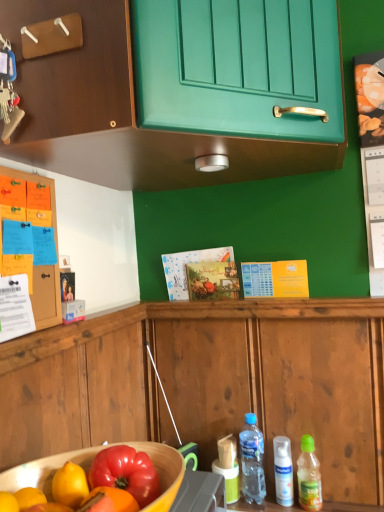
What do you see at coordinates (45, 470) in the screenshot?
I see `wooden bowl at lower left` at bounding box center [45, 470].

How much space does translucent plastic bottle at lower center, arranged as the third bottle when viewed from the right, occupy vertically?

translucent plastic bottle at lower center, arranged as the third bottle when viewed from the right, is 9.50 inches tall.

This screenshot has width=384, height=512. What are the coordinates of `wooden cabinet at left, the second cabinetry viewed from the top` in the screenshot? It's located at (46, 297).

Does wooden cabinet at left, the second cabinetry viewed from the top, touch wooden bowl at lower left?

wooden cabinet at left, the second cabinetry viewed from the top, and wooden bowl at lower left are clearly separated.

Is wooden cabinet at left, the second cabinetry viewed from the top, to the left or to the right of wooden bowl at lower left in the image?

wooden cabinet at left, the second cabinetry viewed from the top, is to the left of wooden bowl at lower left.

Looking at the image, does wooden cabinet at left, the second cabinetry viewed from the top, seem bigger or smaller compared to wooden bowl at lower left?

In the image, wooden cabinet at left, the second cabinetry viewed from the top, appears to be smaller than wooden bowl at lower left.

What's the angular difference between wooden cabinet at left, the second cabinetry viewed from the top, and wooden bowl at lower left's facing directions?

The angular difference between wooden cabinet at left, the second cabinetry viewed from the top, and wooden bowl at lower left is 0.0894 degrees.

From a real-world perspective, does white matte spray can at lower right, the 2th bottle from the left, sit lower than green matte cabinet at upper center, the 2th cabinetry when ordered from bottom to top?

Yes, from a real-world perspective, white matte spray can at lower right, the 2th bottle from the left, is beneath green matte cabinet at upper center, the 2th cabinetry when ordered from bottom to top.

Which object is further away from the camera taking this photo, white matte spray can at lower right, the 2th bottle when ordered from right to left, or green matte cabinet at upper center, the 2th cabinetry when ordered from bottom to top?

white matte spray can at lower right, the 2th bottle when ordered from right to left.

Looking at their sizes, would you say translucent plastic bottle at lower center, positioned as the first bottle in left-to-right order, is wider or thinner than wooden bowl at lower left?

Considering their sizes, translucent plastic bottle at lower center, positioned as the first bottle in left-to-right order, looks slimmer than wooden bowl at lower left.

From a real-world perspective, between translucent plastic bottle at lower center, positioned as the first bottle in left-to-right order, and wooden bowl at lower left, who is vertically lower?

translucent plastic bottle at lower center, positioned as the first bottle in left-to-right order, from a real-world perspective.

In terms of size, does translucent plastic bottle at lower center, arranged as the third bottle when viewed from the right, appear bigger or smaller than wooden bowl at lower left?

In the image, translucent plastic bottle at lower center, arranged as the third bottle when viewed from the right, appears to be smaller than wooden bowl at lower left.

Is translucent plastic bottle at lower center, arranged as the third bottle when viewed from the right, inside or outside of green plastic bottle at lower right, which is counted as the third bottle, starting from the left?

The correct answer is: outside.

Is translucent plastic bottle at lower center, arranged as the third bottle when viewed from the right, oriented towards green plastic bottle at lower right, which is counted as the third bottle, starting from the left?

No.

How different are the orientations of translucent plastic bottle at lower center, arranged as the third bottle when viewed from the right, and green plastic bottle at lower right, placed as the 1th bottle when sorted from right to left, in degrees?

The facing directions of translucent plastic bottle at lower center, arranged as the third bottle when viewed from the right, and green plastic bottle at lower right, placed as the 1th bottle when sorted from right to left, are 0.000612 degrees apart.

The height and width of the screenshot is (512, 384). In order to click on bottle lying above the green plastic bottle at lower right, placed as the 1th bottle when sorted from right to left (from the image's perspective) in this screenshot , I will do click(252, 461).

Which is correct: green plastic bottle at lower right, which is counted as the third bottle, starting from the left, is inside wooden bowl at lower left, or outside of it?

green plastic bottle at lower right, which is counted as the third bottle, starting from the left, is spatially situated outside wooden bowl at lower left.

Is green plastic bottle at lower right, placed as the 1th bottle when sorted from right to left, facing away from wooden bowl at lower left?

green plastic bottle at lower right, placed as the 1th bottle when sorted from right to left, does not have its back to wooden bowl at lower left.

Which object is wider, green plastic bottle at lower right, which is counted as the third bottle, starting from the left, or wooden bowl at lower left?

Wider between the two is wooden bowl at lower left.

Is green plastic bottle at lower right, which is counted as the third bottle, starting from the left, not close to wooden bowl at lower left?

No, green plastic bottle at lower right, which is counted as the third bottle, starting from the left, is not far from wooden bowl at lower left.

Can you tell me how much green matte cabinet at upper center, which is counted as the first cabinetry, starting from the top, and wooden bowl at lower left differ in facing direction?

The angle between the facing direction of green matte cabinet at upper center, which is counted as the first cabinetry, starting from the top, and the facing direction of wooden bowl at lower left is 90 degrees.

Where is `the 2nd cabinetry behind the wooden bowl at lower left, starting your count from the anchor`? The image size is (384, 512). the 2nd cabinetry behind the wooden bowl at lower left, starting your count from the anchor is located at coordinates (181, 91).

Relative to wooden bowl at lower left, is green matte cabinet at upper center, the 2th cabinetry when ordered from bottom to top, in front or behind?

In the image, green matte cabinet at upper center, the 2th cabinetry when ordered from bottom to top, appears behind wooden bowl at lower left.

Is point (120, 153) less distant than point (50, 464)?

No, it is not.

Is wooden bowl at lower left smaller than green plastic bottle at lower right, placed as the 1th bottle when sorted from right to left?

Incorrect, wooden bowl at lower left is not smaller in size than green plastic bottle at lower right, placed as the 1th bottle when sorted from right to left.

From a real-world perspective, which object rests below the other?

green plastic bottle at lower right, which is counted as the third bottle, starting from the left, is physically lower.

Considering the positions of point (20, 466) and point (306, 463), is point (20, 466) closer or farther from the camera than point (306, 463)?

Point (20, 466).

Which object is positioned more to the right, wooden bowl at lower left or green plastic bottle at lower right, placed as the 1th bottle when sorted from right to left?

green plastic bottle at lower right, placed as the 1th bottle when sorted from right to left.

From the wooden bowl at lower left, count 1st cabinetrys backward and point to it. Please provide its 2D coordinates.

[(46, 297)]

In order to click on the 1st cabinetry counting from the left side of the white matte spray can at lower right, the 2th bottle from the left in this screenshot , I will do `click(181, 91)`.

Based on their spatial positions, is wooden bowl at lower left or white matte spray can at lower right, the 2th bottle from the left, closer to translucent plastic bottle at lower center, arranged as the third bottle when viewed from the right?

Among the two, white matte spray can at lower right, the 2th bottle from the left, is located nearer to translucent plastic bottle at lower center, arranged as the third bottle when viewed from the right.

From the image, which object appears to be nearer to white matte spray can at lower right, the 2th bottle from the left, wooden bowl at lower left or translucent plastic bottle at lower center, positioned as the first bottle in left-to-right order?

translucent plastic bottle at lower center, positioned as the first bottle in left-to-right order, is positioned closer to the anchor white matte spray can at lower right, the 2th bottle from the left.

From the image, which object appears to be farther from green plastic bottle at lower right, which is counted as the third bottle, starting from the left, wooden cabinet at left, the second cabinetry viewed from the top, or green matte cabinet at upper center, which is counted as the first cabinetry, starting from the top?

Based on the image, green matte cabinet at upper center, which is counted as the first cabinetry, starting from the top, appears to be further to green plastic bottle at lower right, which is counted as the third bottle, starting from the left.

Looking at the image, which one is located closer to wooden bowl at lower left, translucent plastic bottle at lower center, positioned as the first bottle in left-to-right order, or wooden cabinet at left, the second cabinetry viewed from the top?

Based on the image, wooden cabinet at left, the second cabinetry viewed from the top, appears to be nearer to wooden bowl at lower left.

Considering their positions, is white matte spray can at lower right, the 2th bottle when ordered from right to left, positioned further to wooden bowl at lower left than translucent plastic bottle at lower center, arranged as the third bottle when viewed from the right?

Among the two, white matte spray can at lower right, the 2th bottle when ordered from right to left, is located further to wooden bowl at lower left.

Based on their spatial positions, is wooden bowl at lower left or wooden cabinet at left, the 1th cabinetry in the bottom-to-top sequence, closer to translucent plastic bottle at lower center, arranged as the third bottle when viewed from the right?

The object closer to translucent plastic bottle at lower center, arranged as the third bottle when viewed from the right, is wooden bowl at lower left.

Considering their positions, is wooden cabinet at left, the 1th cabinetry in the bottom-to-top sequence, positioned further to green matte cabinet at upper center, which is counted as the first cabinetry, starting from the top, than translucent plastic bottle at lower center, arranged as the third bottle when viewed from the right?

Based on the image, translucent plastic bottle at lower center, arranged as the third bottle when viewed from the right, appears to be further to green matte cabinet at upper center, which is counted as the first cabinetry, starting from the top.

From the image, which object appears to be farther from green plastic bottle at lower right, placed as the 1th bottle when sorted from right to left, white matte spray can at lower right, the 2th bottle when ordered from right to left, or translucent plastic bottle at lower center, positioned as the first bottle in left-to-right order?

translucent plastic bottle at lower center, positioned as the first bottle in left-to-right order.

Locate an element on the screen. bottle between wooden bowl at lower left and white matte spray can at lower right, the 2th bottle when ordered from right to left, in the front-back direction is located at coordinates (309, 476).

This screenshot has height=512, width=384. I want to click on bottle between green matte cabinet at upper center, the 2th cabinetry when ordered from bottom to top, and green plastic bottle at lower right, placed as the 1th bottle when sorted from right to left, from top to bottom, so click(252, 461).

I want to click on bowl between green matte cabinet at upper center, the 2th cabinetry when ordered from bottom to top, and green plastic bottle at lower right, which is counted as the third bottle, starting from the left, in the vertical direction, so click(x=45, y=470).

At what (x,y) coordinates should I click in order to perform the action: click on cabinetry between green matte cabinet at upper center, the 2th cabinetry when ordered from bottom to top, and green plastic bottle at lower right, which is counted as the third bottle, starting from the left, vertically. Please return your answer as a coordinate pair (x, y). This screenshot has width=384, height=512. Looking at the image, I should click on (46, 297).